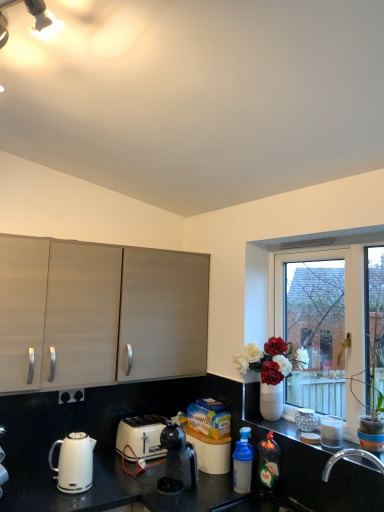
Identify the location of free space above white glass window at right (from a real-world perspective). (326, 245).